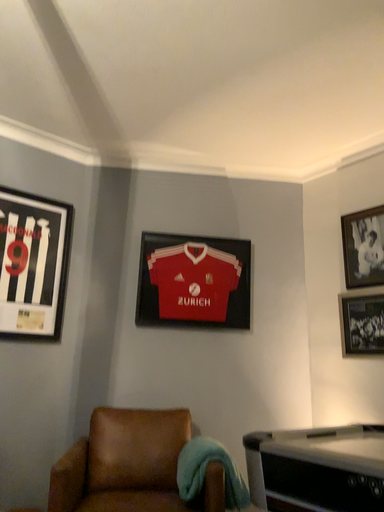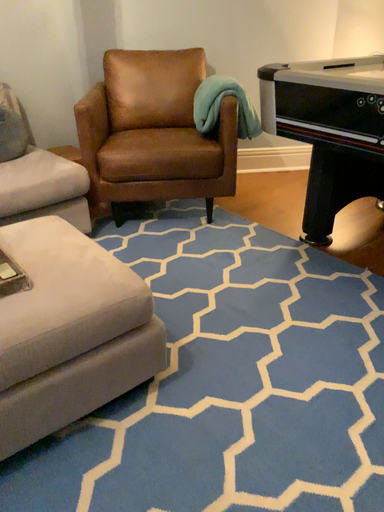
Question: Which way did the camera rotate in the video?

Choices:
 (A) rotated upward
 (B) rotated downward

Answer: (B)